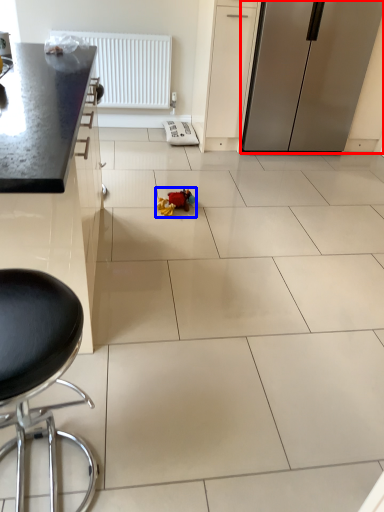
Question: Which point is further to the camera, refrigerator (highlighted by a red box) or toy (highlighted by a blue box)?

Choices:
 (A) refrigerator
 (B) toy

Answer: (A)